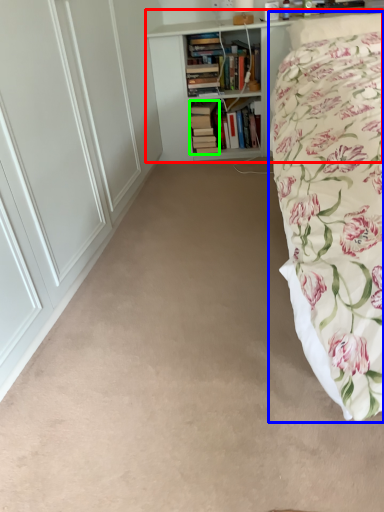
Question: Based on their relative distances, which object is farther from bookcase (highlighted by a red box)? Choose from bed (highlighted by a blue box) and book (highlighted by a green box).

Choices:
 (A) bed
 (B) book

Answer: (A)